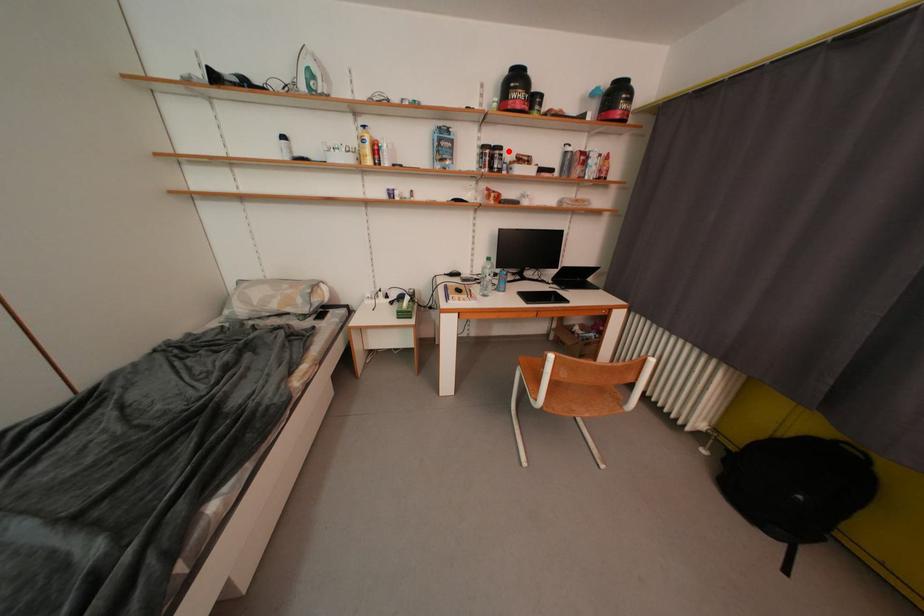
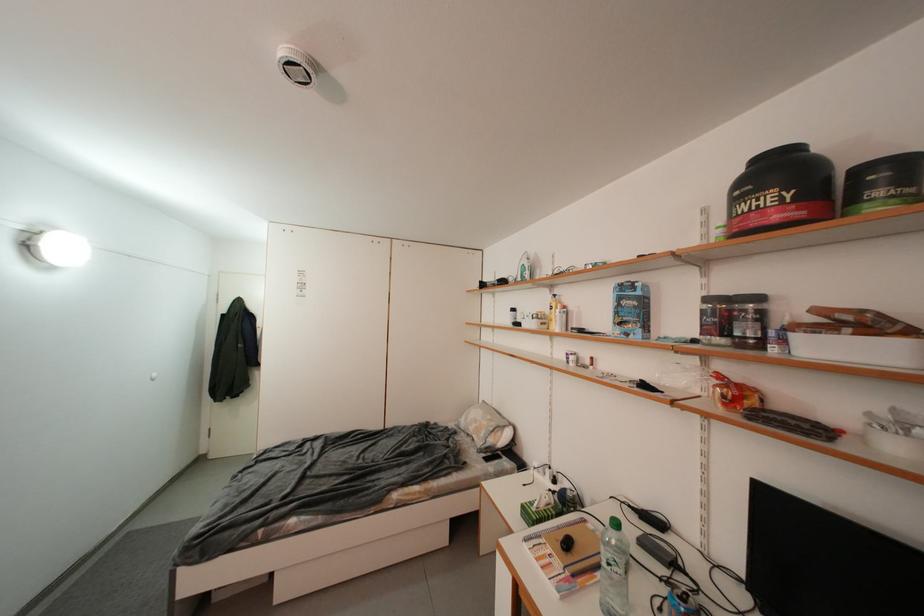
The point at the highlighted location is marked in the first image. Where is the corresponding point in the second image?

(766, 301)